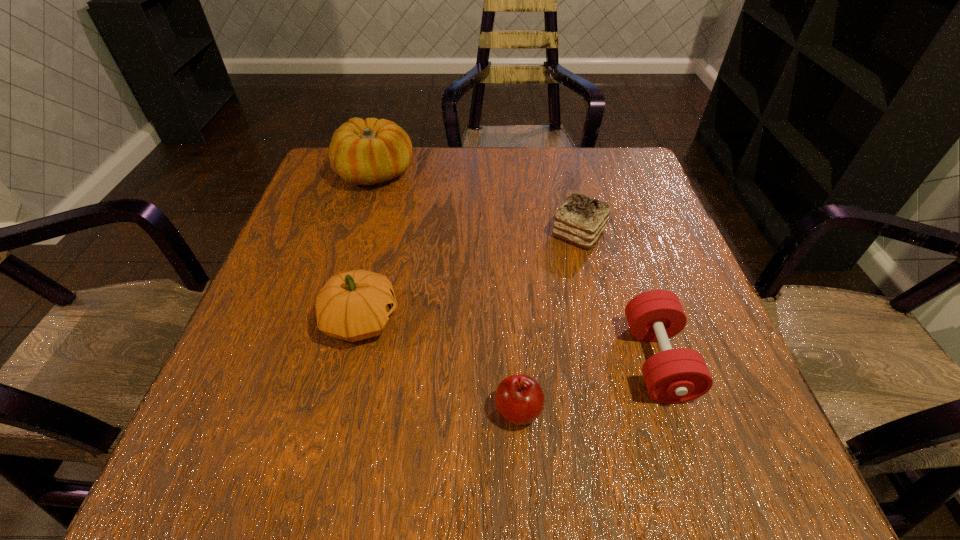
At what (x,y) coordinates should I click in order to perform the action: click on the farthest object. Please return your answer as a coordinate pair (x, y). Looking at the image, I should click on (362, 152).

What are the coordinates of `the nearer gourd` in the screenshot? It's located at (355, 305).

What are the coordinates of `dumbbell` in the screenshot? It's located at (678, 375).

The image size is (960, 540). In order to click on the second farthest object in this screenshot , I will do `click(580, 220)`.

Image resolution: width=960 pixels, height=540 pixels. Identify the location of the third object from right to left. (519, 399).

Where is `vacant space located on the front of the farther gourd`? This screenshot has width=960, height=540. vacant space located on the front of the farther gourd is located at coordinates (339, 296).

Where is `free space located 0.080m on the side of the nearer gourd with the carved face`? The width and height of the screenshot is (960, 540). free space located 0.080m on the side of the nearer gourd with the carved face is located at coordinates (444, 320).

Identify the location of vacant space located on the back of the dumbbell. (621, 251).

Locate an element on the screen. The height and width of the screenshot is (540, 960). blank space located on the left of the chocolate cake is located at coordinates click(519, 233).

Where is `free space located on the right of the apple`? The width and height of the screenshot is (960, 540). free space located on the right of the apple is located at coordinates (580, 410).